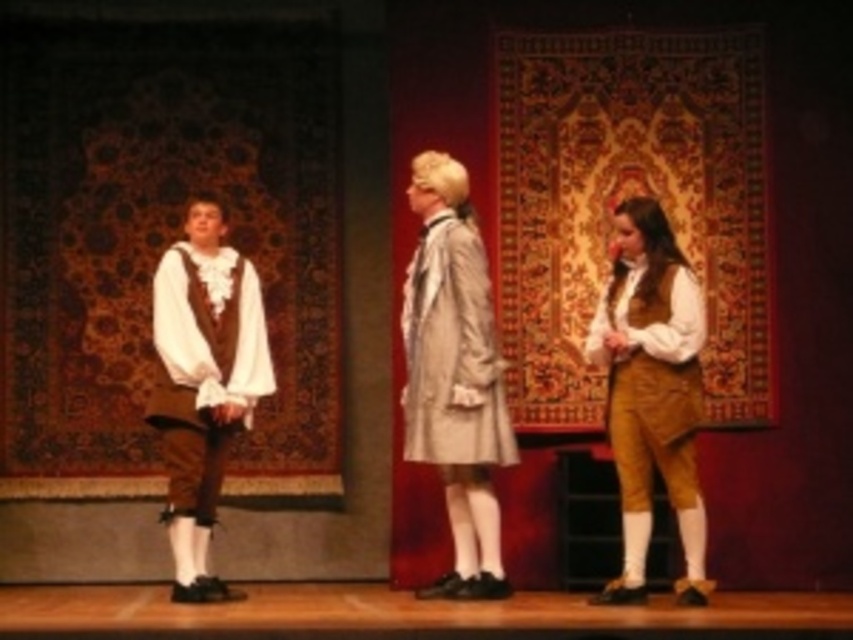
Question: Among these points, which one is farthest from the camera?

Choices:
 (A) (439, 365)
 (B) (230, 371)

Answer: (B)

Question: Does matte brown vest at right appear under matte white shirt at left?

Choices:
 (A) no
 (B) yes

Answer: (B)

Question: Does matte brown vest at right have a larger size compared to light beige fabric dress at center?

Choices:
 (A) no
 (B) yes

Answer: (B)

Question: Among these objects, which one is nearest to the camera?

Choices:
 (A) matte brown vest at right
 (B) light beige fabric dress at center
 (C) matte white shirt at left

Answer: (A)

Question: Based on their relative distances, which object is nearer to the light beige fabric dress at center?

Choices:
 (A) matte white shirt at left
 (B) matte brown vest at right

Answer: (B)

Question: Considering the relative positions of matte brown vest at right and light beige fabric dress at center in the image provided, where is matte brown vest at right located with respect to light beige fabric dress at center?

Choices:
 (A) below
 (B) above

Answer: (A)